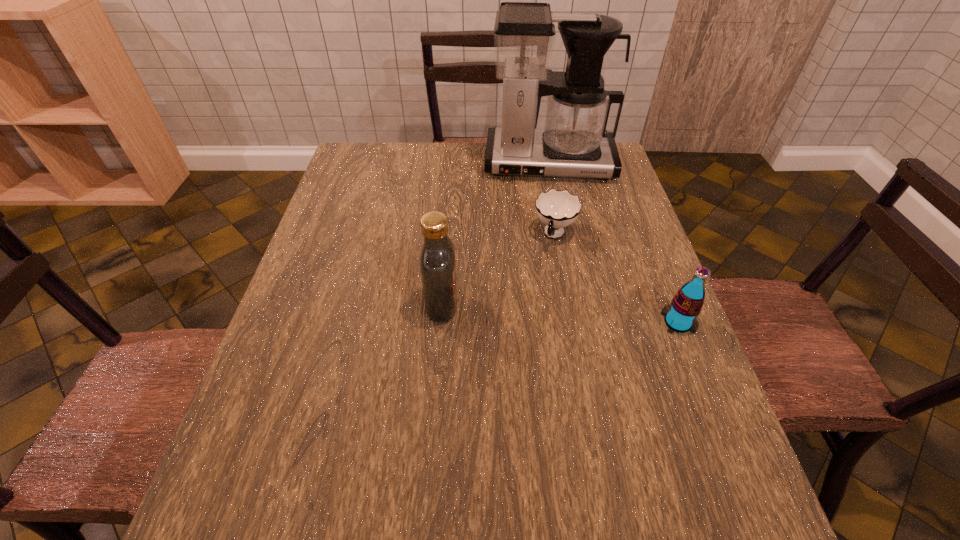
Find the location of a particular element. The height and width of the screenshot is (540, 960). the second tallest object is located at coordinates (437, 263).

The height and width of the screenshot is (540, 960). Find the location of `vodka`. vodka is located at coordinates (437, 263).

Where is `soda`? The width and height of the screenshot is (960, 540). soda is located at coordinates (680, 316).

You are a GUI agent. You are given a task and a screenshot of the screen. Output one action in this format:
    pyautogui.click(x=<x>, y=<y>)
    Task: Click on the cup
    The image size is (960, 540).
    Given the screenshot: What is the action you would take?
    pyautogui.click(x=556, y=209)

This screenshot has height=540, width=960. I want to click on the shortest object, so click(556, 209).

At what (x,y) coordinates should I click in order to perform the action: click on the farthest object. Please return your answer as a coordinate pair (x, y). The width and height of the screenshot is (960, 540). Looking at the image, I should click on (574, 142).

At what (x,y) coordinates should I click in order to perform the action: click on coffee maker. Please return your answer as a coordinate pair (x, y). Image resolution: width=960 pixels, height=540 pixels. Looking at the image, I should click on (574, 142).

Locate an element on the screen. The width and height of the screenshot is (960, 540). free region located 0.250m on the front-facing side of the leftmost object is located at coordinates (564, 305).

I want to click on vacant space located on the back of the soda, so click(x=639, y=225).

Where is `vacant space located on the side of the cup with the handle`? vacant space located on the side of the cup with the handle is located at coordinates (527, 321).